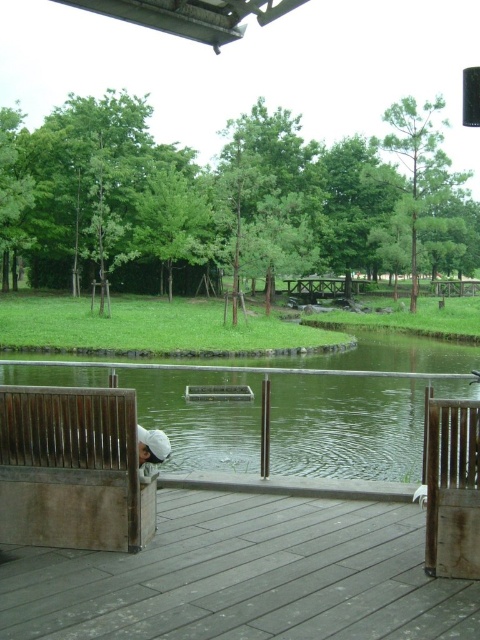
Question: Is the position of brown wooden bench at lower left less distant than that of brown wooden bench at right?

Choices:
 (A) yes
 (B) no

Answer: (B)

Question: Which point is closer to the camera taking this photo?

Choices:
 (A) (204, 608)
 (B) (131, 499)

Answer: (A)

Question: Can you confirm if wooden deck at lower center is positioned to the right of brown wooden bench at lower left?

Choices:
 (A) no
 (B) yes

Answer: (B)

Question: Does wooden deck at lower center lie behind brown wooden bench at right?

Choices:
 (A) no
 (B) yes

Answer: (A)

Question: Based on their relative distances, which object is farther from the brown wooden bench at right?

Choices:
 (A) brown wooden bench at lower left
 (B) wooden deck at lower center

Answer: (A)

Question: Among these points, which one is farthest from the camera?

Choices:
 (A) (131, 611)
 (B) (455, 492)
 (C) (84, 500)

Answer: (C)